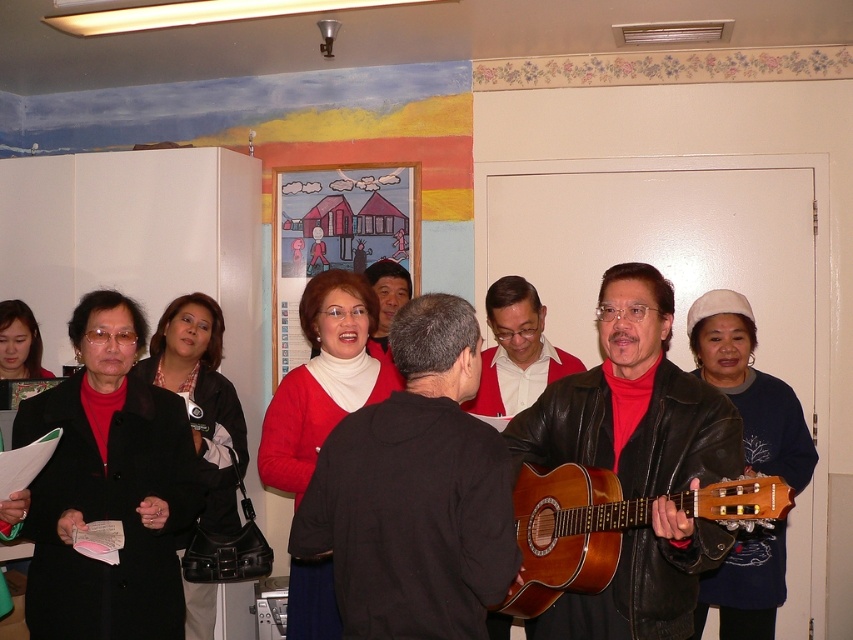
Question: From the image, what is the correct spatial relationship of matte black jacket at center in relation to black leather jacket at left?

Choices:
 (A) below
 (B) above

Answer: (B)

Question: Which object is closer to the camera taking this photo?

Choices:
 (A) red matte sweater at center
 (B) matte black guitar at center

Answer: (B)

Question: Which point is farther from the camera taking this photo?

Choices:
 (A) (376, 417)
 (B) (563, 550)
 (C) (630, 401)

Answer: (C)

Question: Which object is positioned closest to the matte black guitar at center?

Choices:
 (A) brown wooden guitar at center
 (B) black leather jacket at left

Answer: (A)

Question: Where is brown wooden guitar at center located in relation to black leather jacket at left in the image?

Choices:
 (A) below
 (B) above

Answer: (B)

Question: In this image, where is matte black guitar at center located relative to red matte sweater at center?

Choices:
 (A) below
 (B) above

Answer: (A)